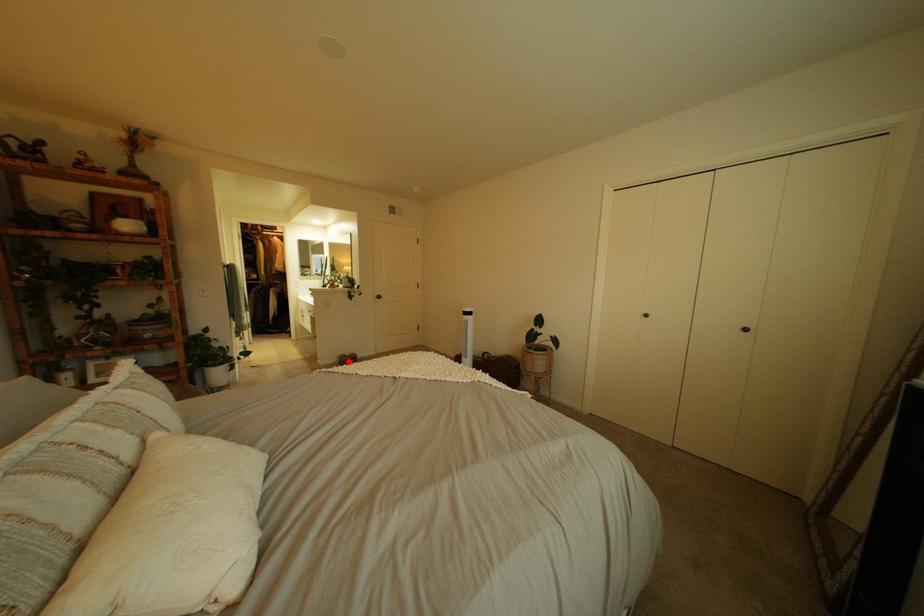
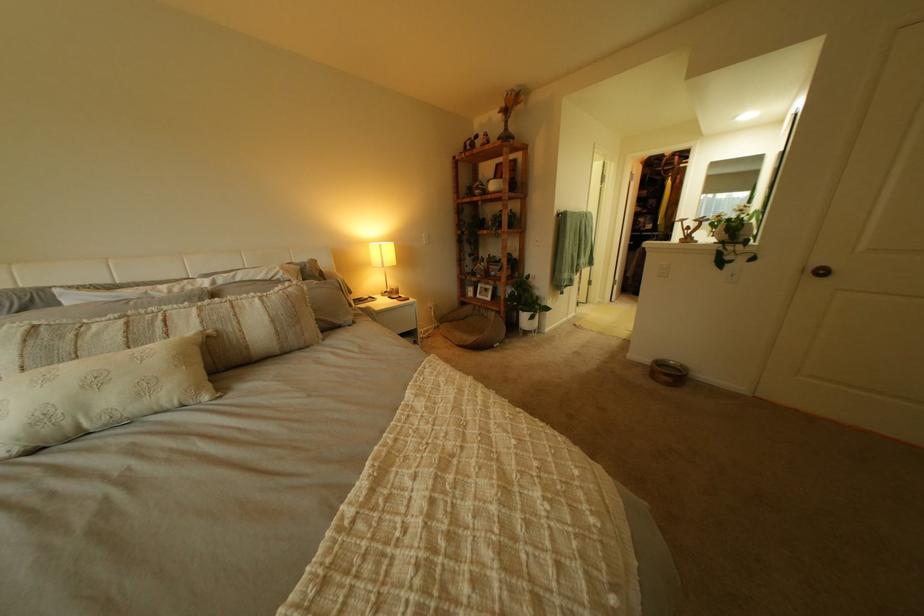
Find the pixel in the second image that matches the highlighted location in the first image.

(663, 362)